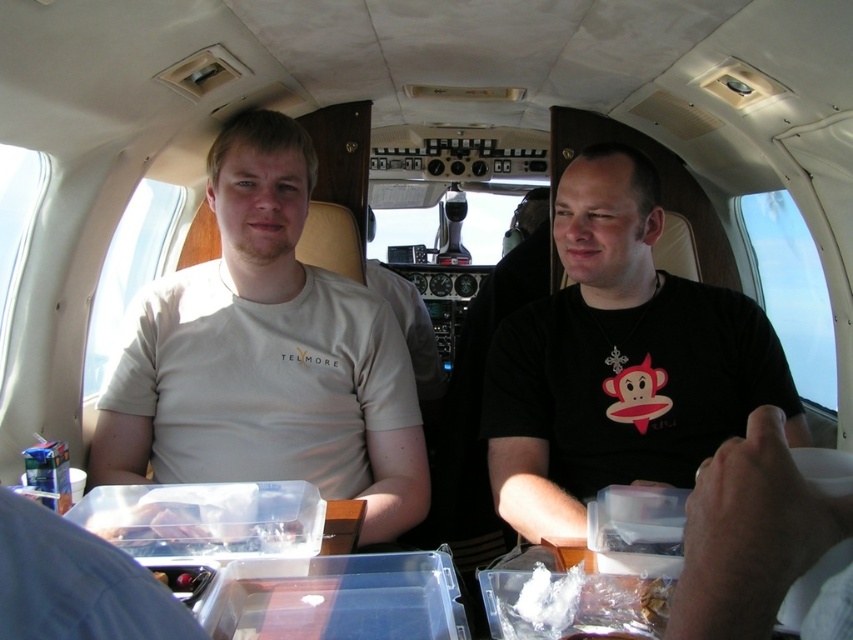
Which is above, white matte t-shirt at center or white crumbly food at lower center?

white matte t-shirt at center is higher up.

Who is shorter, white matte t-shirt at center or white crumbly food at lower center?

Standing shorter between the two is white crumbly food at lower center.

Between point (378, 394) and point (502, 628), which one is positioned in front?

Positioned in front is point (502, 628).

Identify the location of white matte t-shirt at center. This screenshot has height=640, width=853. (265, 355).

Who is positioned more to the right, black matte t-shirt at center or white crumbly food at lower center?

From the viewer's perspective, black matte t-shirt at center appears more on the right side.

Can you confirm if black matte t-shirt at center is smaller than white crumbly food at lower center?

Incorrect, black matte t-shirt at center is not smaller in size than white crumbly food at lower center.

Is point (726, 378) closer to viewer compared to point (619, 576)?

No, it is behind (619, 576).

Where is `black matte t-shirt at center`? This screenshot has width=853, height=640. black matte t-shirt at center is located at coordinates (619, 360).

Does white matte t-shirt at center appear over black matte t-shirt at center?

Actually, white matte t-shirt at center is below black matte t-shirt at center.

Which is behind, point (221, 250) or point (579, 257)?

The point (221, 250) is more distant.

Image resolution: width=853 pixels, height=640 pixels. Identify the location of white matte t-shirt at center. (265, 355).